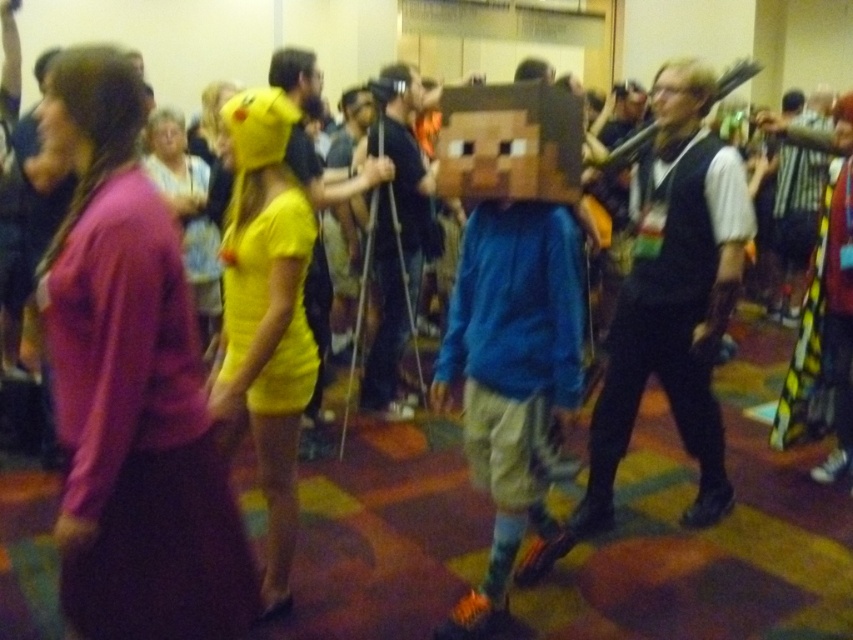
Does purple matte sweater at left have a lesser height compared to matte black vest at center?

Indeed, purple matte sweater at left has a lesser height compared to matte black vest at center.

The width and height of the screenshot is (853, 640). Find the location of `purple matte sweater at left`. purple matte sweater at left is located at coordinates (131, 387).

Identify the location of purple matte sweater at left. This screenshot has height=640, width=853. (131, 387).

Is matte black vest at center further to the viewer compared to wooden block at center?

Yes, matte black vest at center is behind wooden block at center.

Can you confirm if matte black vest at center is positioned below wooden block at center?

Yes.

Who is more forward, (685, 193) or (468, 104)?

Point (468, 104) is in front.

You are a GUI agent. You are given a task and a screenshot of the screen. Output one action in this format:
    pyautogui.click(x=<x>, y=<y>)
    Task: Click on the matte black vest at center
    
    Given the screenshot: What is the action you would take?
    pyautogui.click(x=672, y=296)

Can you confirm if purple matte sweater at left is positioned to the left of wooden block at center?

Indeed, purple matte sweater at left is positioned on the left side of wooden block at center.

Can you confirm if purple matte sweater at left is positioned above wooden block at center?

No, purple matte sweater at left is not above wooden block at center.

Does point (173, 637) come farther from viewer compared to point (556, 193)?

No, it is in front of (556, 193).

Locate an element on the screen. The image size is (853, 640). purple matte sweater at left is located at coordinates (131, 387).